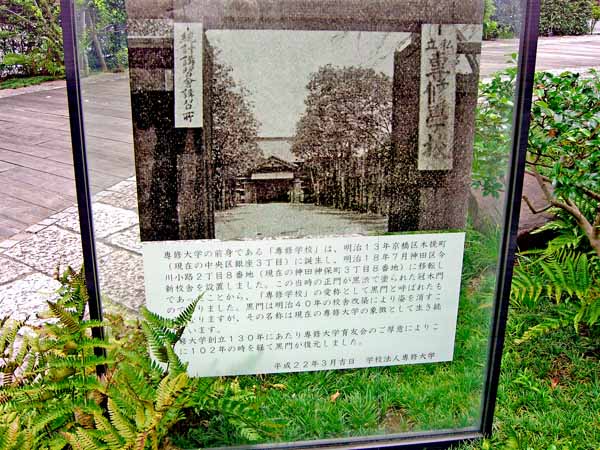
The image size is (600, 450). What are the coordinates of `green plant` in the screenshot? It's located at (66, 388).